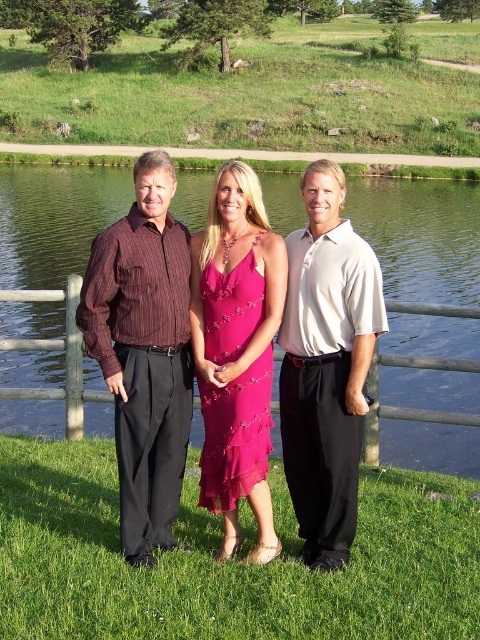
Is matte black dress at center bigger than pink satin dress at center?

Yes.

Is point (143, 193) more distant than point (193, 307)?

No.

Which is behind, point (314, 168) or point (284, 291)?

Positioned behind is point (314, 168).

Find the location of a particular element. The height and width of the screenshot is (640, 480). matte black dress at center is located at coordinates (237, 349).

Which is below, green grass at lower center or white cotton polo shirt at center?

green grass at lower center is lower down.

Who is positioned more to the right, green grass at lower center or white cotton polo shirt at center?

white cotton polo shirt at center is more to the right.

The width and height of the screenshot is (480, 640). Identify the location of green grass at lower center. (226, 563).

Where is `green grass at lower center`? green grass at lower center is located at coordinates (226, 563).

Which is more to the right, striped cotton shirt at center or white cotton polo shirt at center?

Positioned to the right is white cotton polo shirt at center.

Is striped cotton shirt at center above white cotton polo shirt at center?

Actually, striped cotton shirt at center is below white cotton polo shirt at center.

Does point (157, 374) lie behind point (379, 275)?

No.

The width and height of the screenshot is (480, 640). Find the location of `striped cotton shirt at center`. striped cotton shirt at center is located at coordinates (144, 353).